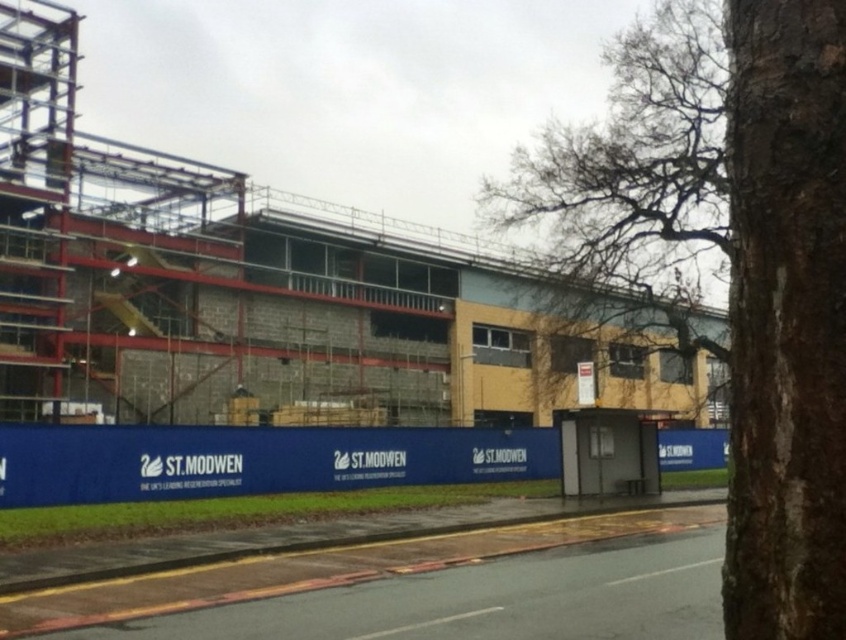
You are a drone operator tasked with capturing aerial footage of the construction site. You need to fly your drone from the point at coordinates point (655,241) to the point at coordinates point (841,435). Considering the building structure and scaffolding in between, will the drone have a clear path to fly directly between these two points?

Point (655,241) is behind point (841,435), so the drone will not have a clear path to fly directly between these two points as the first point is obstructed by the second point from the drone operator perspective.

You are a surveyor standing at the base of the building. You notice a point marked at coordinates (784, 320). What object does this point correspond to?

The point at coordinates (784, 320) corresponds to the brown rough bark tree at right.

You are a construction worker looking at the construction site. You see a brown rough bark tree at right and bare branches at upper right. Which object is closer to the left side of the image?

The brown rough bark tree at right is positioned on the left side of bare branches at upper right, so it is closer to the left side of the image.